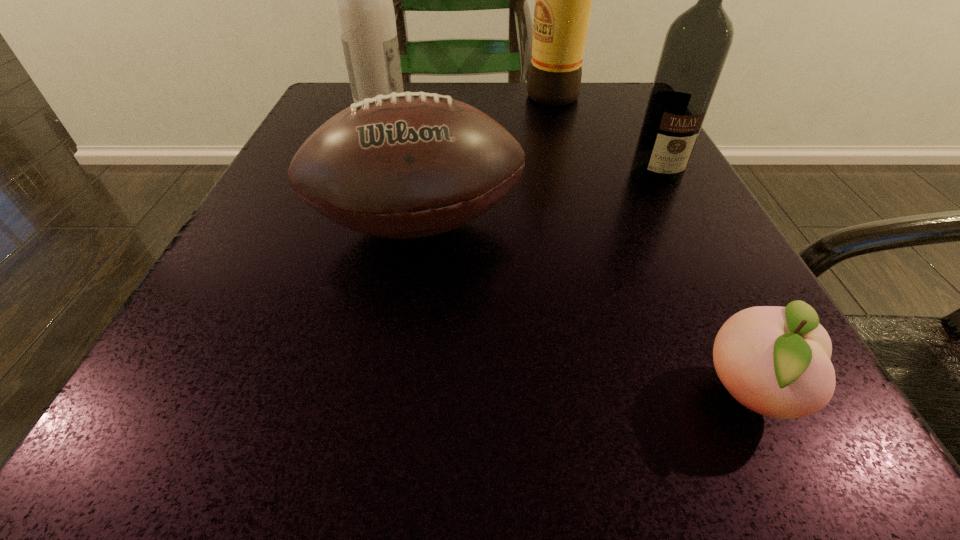
In order to click on free point at the far edge in this screenshot , I will do `click(485, 86)`.

The width and height of the screenshot is (960, 540). What are the coordinates of `vacant area at the near edge` in the screenshot? It's located at (492, 423).

Find the location of a particular element. This screenshot has height=540, width=960. vacant space at the left edge is located at coordinates (287, 285).

The height and width of the screenshot is (540, 960). I want to click on vacant space at the right edge, so click(716, 285).

I want to click on free space at the far right corner of the desktop, so click(573, 114).

This screenshot has width=960, height=540. What are the coordinates of `vacant space at the near right corner of the desktop` in the screenshot? It's located at (852, 495).

The image size is (960, 540). I want to click on vacant area between the leftmost alcohol and the rightmost alcohol, so click(x=518, y=141).

Where is `vacant space that's between the second alcohol from left to right and the nearest alcohol`? vacant space that's between the second alcohol from left to right and the nearest alcohol is located at coordinates (605, 136).

Find the location of a particular element. empty space between the second alcohol from left to right and the shortest object is located at coordinates (651, 245).

The width and height of the screenshot is (960, 540). I want to click on vacant space in between the second alcohol from left to right and the peach, so click(x=651, y=245).